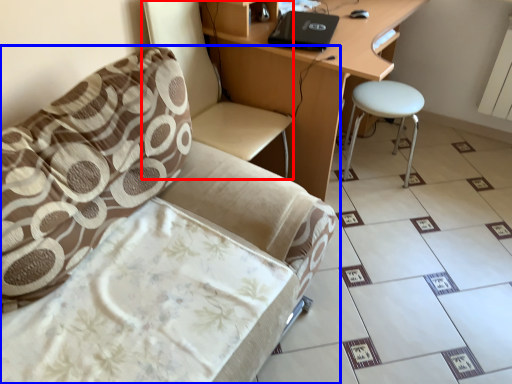
Question: Among these objects, which one is nearest to the camera, swivel chair (highlighted by a red box) or chair (highlighted by a blue box)?

Choices:
 (A) swivel chair
 (B) chair

Answer: (B)